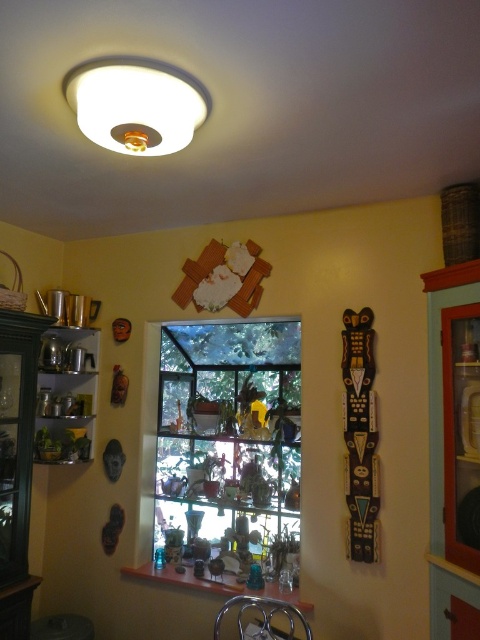
Between point (288, 435) and point (163, 116), which one is positioned in front?

Point (163, 116) is more forward.

Can you confirm if clear glass window at center is positioned below white matte light fixture at upper center?

Yes.

Does point (249, 362) lie in front of point (140, 116)?

No.

The image size is (480, 640). I want to click on clear glass window at center, so click(228, 435).

From the picture: Who is higher up, white matte light fixture at upper center or metallic shiny pots at left?

white matte light fixture at upper center is higher up.

Where is `white matte light fixture at upper center`? Image resolution: width=480 pixels, height=640 pixels. white matte light fixture at upper center is located at coordinates (135, 104).

In order to click on white matte light fixture at upper center in this screenshot , I will do `click(135, 104)`.

Who is higher up, clear glass window at center or metallic shiny pots at left?

metallic shiny pots at left is above.

The image size is (480, 640). What do you see at coordinates (228, 435) in the screenshot?
I see `clear glass window at center` at bounding box center [228, 435].

Identify the location of clear glass window at center. The height and width of the screenshot is (640, 480). (228, 435).